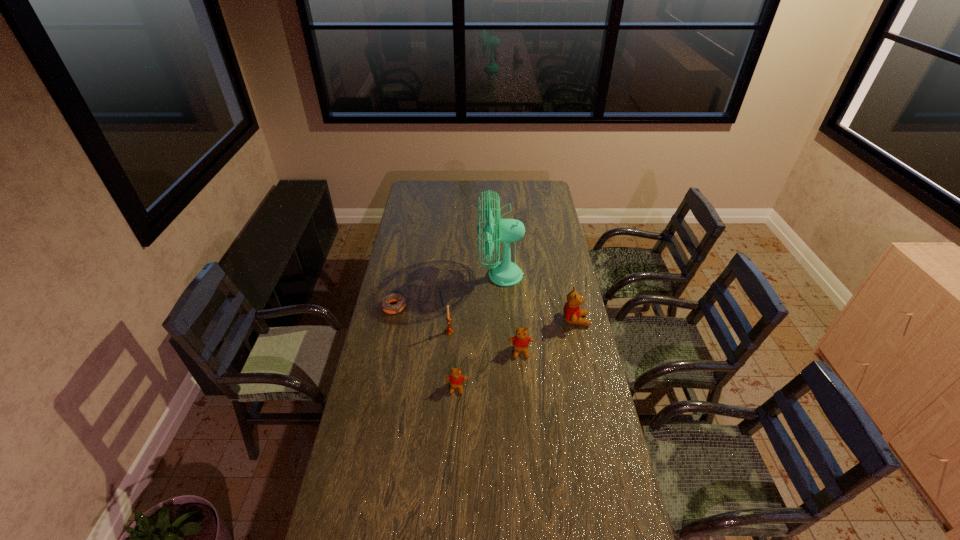
With all teddy bears evenly spaced, where should an extra teddy bear be placed on the left to continue the pattern? Please point out a vacant space. Please provide its 2D coordinates. Your answer should be formatted as a tuple, i.e. [(x, y)], where the tuple contains the x and y coordinates of a point satisfying the conditions above.

[(382, 430)]